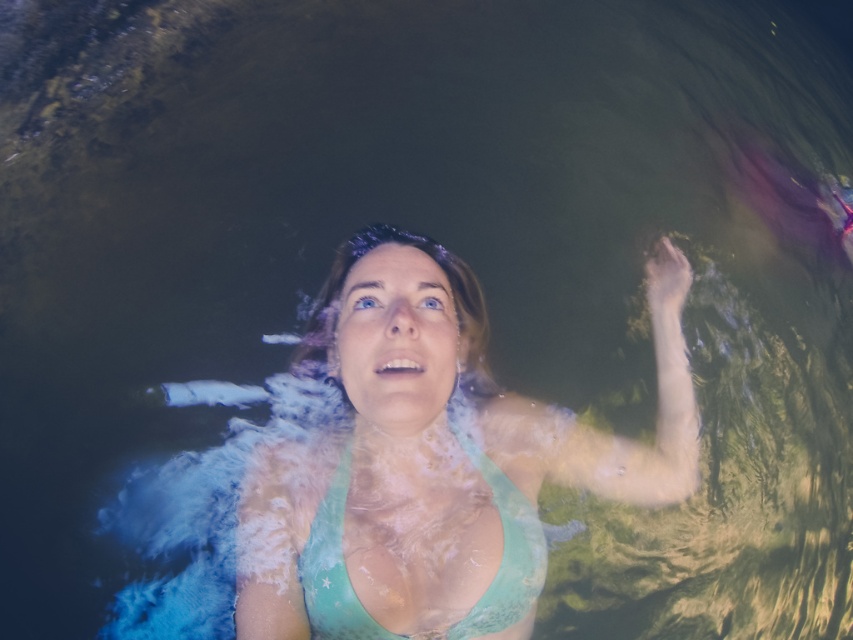
Question: Which object is farther from the camera taking this photo?

Choices:
 (A) teal fabric bikini top at center
 (B) teal lace bikini top at center

Answer: (A)

Question: Is teal lace bikini top at center wider than teal fabric bikini top at center?

Choices:
 (A) yes
 (B) no

Answer: (A)

Question: Can you confirm if teal lace bikini top at center is positioned to the left of teal fabric bikini top at center?

Choices:
 (A) no
 (B) yes

Answer: (A)

Question: Can you confirm if teal lace bikini top at center is bigger than teal fabric bikini top at center?

Choices:
 (A) yes
 (B) no

Answer: (A)

Question: Which point appears farthest from the camera in this image?

Choices:
 (A) (529, 580)
 (B) (462, 296)

Answer: (B)